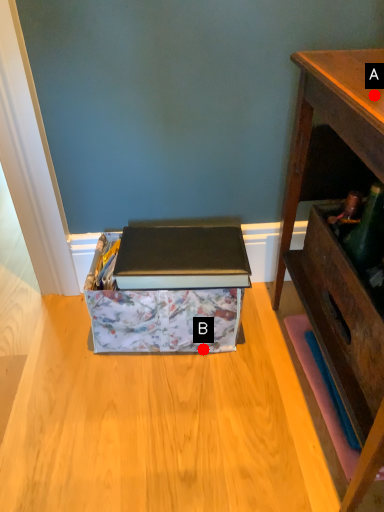
Question: Two points are circled on the image, labeled by A and B beside each circle. Which of the following is the farthest from the observer?

Choices:
 (A) A is further
 (B) B is further

Answer: (B)